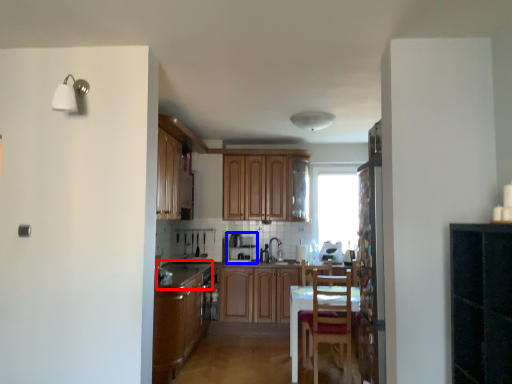
Question: Which point is further to the camera, counter top (highlighted by a red box) or appliance (highlighted by a blue box)?

Choices:
 (A) counter top
 (B) appliance

Answer: (B)